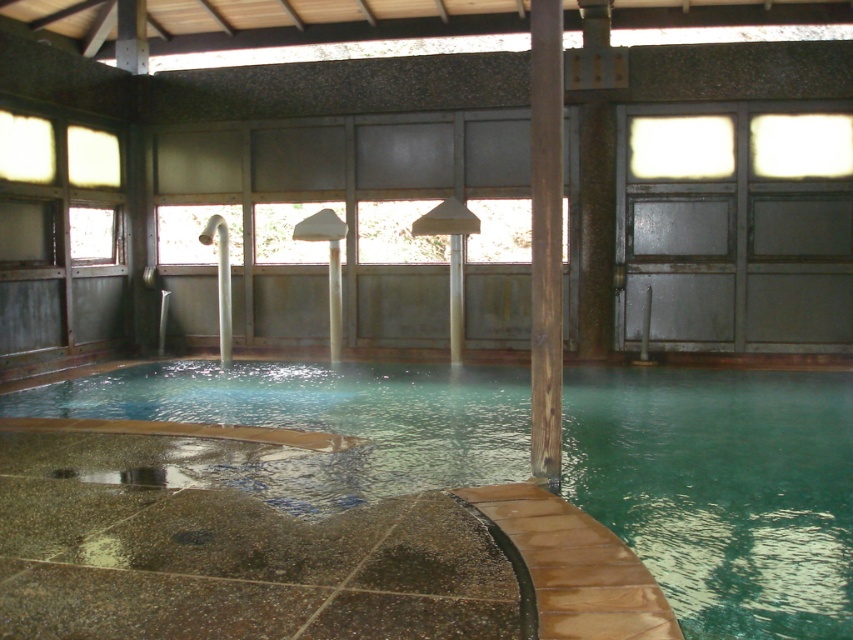
Question: Is green polished stone swimming pool at center wider than brown wood pillar at center?

Choices:
 (A) yes
 (B) no

Answer: (A)

Question: Which of the following is the closest to the observer?

Choices:
 (A) brown wood pillar at center
 (B) green polished stone swimming pool at center

Answer: (A)

Question: Which of the following is the closest to the observer?

Choices:
 (A) (538, 6)
 (B) (165, 412)

Answer: (A)

Question: Is green polished stone swimming pool at center positioned in front of brown wood pillar at center?

Choices:
 (A) no
 (B) yes

Answer: (A)

Question: Is the position of green polished stone swimming pool at center more distant than that of brown wood pillar at center?

Choices:
 (A) no
 (B) yes

Answer: (B)